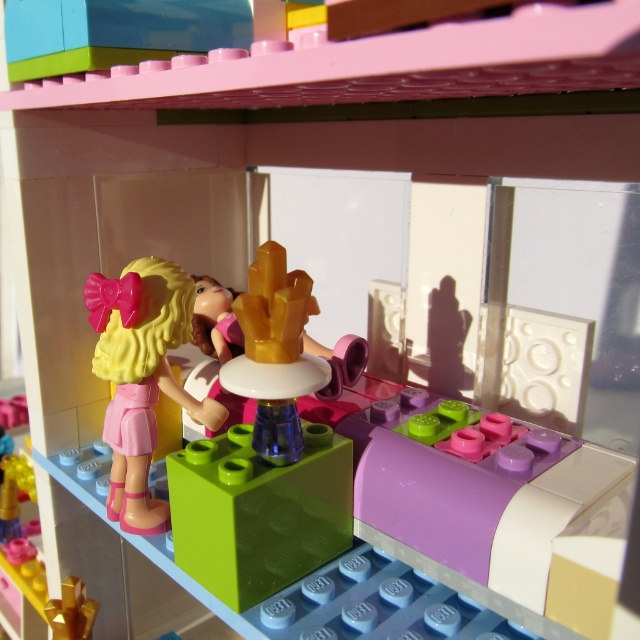
Question: Is translucent green block at center closer to camera compared to matte pink plastic doll at left?

Choices:
 (A) yes
 (B) no

Answer: (A)

Question: Which of the following is the closest to the observer?

Choices:
 (A) translucent green block at center
 (B) matte pink plastic doll at left

Answer: (A)

Question: Where is translucent green block at center located in relation to matte pink plastic doll at left in the image?

Choices:
 (A) below
 (B) above

Answer: (A)

Question: Where is translucent green block at center located in relation to matte pink plastic doll at left in the image?

Choices:
 (A) left
 (B) right

Answer: (B)